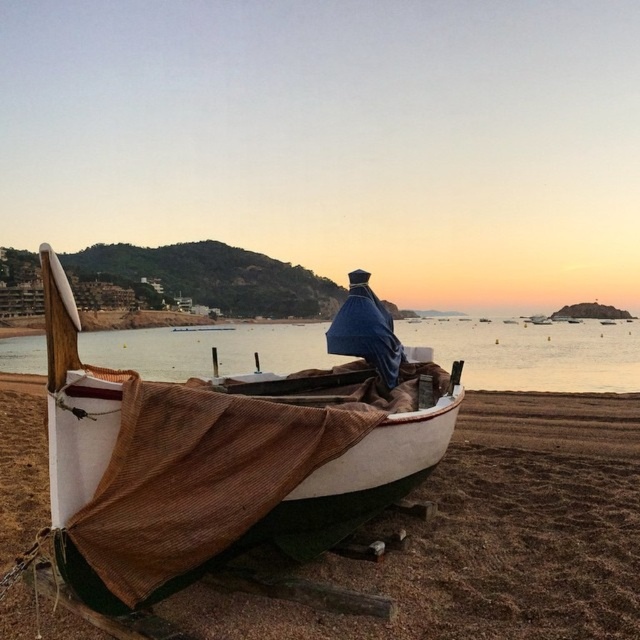
Question: Can you confirm if green canvas boat at center is positioned to the right of blue fabric at center?

Choices:
 (A) yes
 (B) no

Answer: (B)

Question: Does brown sand at lower center lie in front of matte brown water at center?

Choices:
 (A) no
 (B) yes

Answer: (A)

Question: Does matte brown water at center have a lesser width compared to blue fabric at center?

Choices:
 (A) yes
 (B) no

Answer: (B)

Question: Which of the following is the closest to the observer?

Choices:
 (A) matte brown water at center
 (B) green canvas boat at center
 (C) brown sand at lower center
 (D) blue fabric at center

Answer: (B)

Question: Which point appears closest to the camera in this image?

Choices:
 (A) (337, 385)
 (B) (44, 353)
 (C) (337, 333)

Answer: (C)

Question: Which of the following is the farthest from the observer?

Choices:
 (A) (522, 326)
 (B) (252, 632)
 (C) (346, 304)
 (D) (371, 378)

Answer: (A)